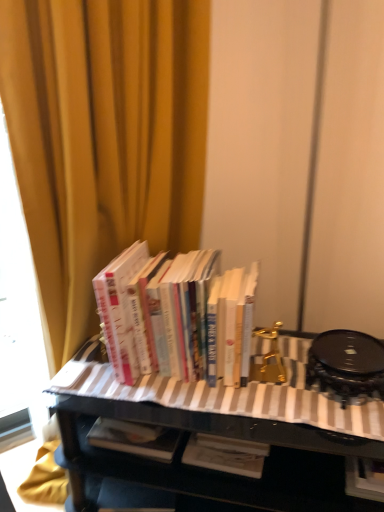
Question: Should I look upward or downward to see black glossy table at center?

Choices:
 (A) up
 (B) down

Answer: (B)

Question: From a real-world perspective, is hardcover books at center positioned under yellow fabric curtain at upper left based on gravity?

Choices:
 (A) no
 (B) yes

Answer: (B)

Question: Does hardcover books at center have a smaller size compared to yellow fabric curtain at upper left?

Choices:
 (A) yes
 (B) no

Answer: (A)

Question: Is hardcover books at center wider than yellow fabric curtain at upper left?

Choices:
 (A) yes
 (B) no

Answer: (B)

Question: Is hardcover books at center to the right of yellow fabric curtain at upper left from the viewer's perspective?

Choices:
 (A) yes
 (B) no

Answer: (A)

Question: Is hardcover books at center oriented away from yellow fabric curtain at upper left?

Choices:
 (A) yes
 (B) no

Answer: (A)

Question: Does hardcover books at center have a lesser width compared to yellow fabric curtain at upper left?

Choices:
 (A) yes
 (B) no

Answer: (A)

Question: Could you tell me if black glossy table at center is turned towards hardcover books at center?

Choices:
 (A) yes
 (B) no

Answer: (B)

Question: Is black glossy table at center closer to the viewer compared to hardcover books at center?

Choices:
 (A) yes
 (B) no

Answer: (A)

Question: Is black glossy table at center shorter than hardcover books at center?

Choices:
 (A) yes
 (B) no

Answer: (B)

Question: Can you confirm if black glossy table at center is thinner than hardcover books at center?

Choices:
 (A) yes
 (B) no

Answer: (B)

Question: Can you confirm if black glossy table at center is taller than hardcover books at center?

Choices:
 (A) no
 (B) yes

Answer: (B)

Question: Is black glossy table at center far away from hardcover books at center?

Choices:
 (A) yes
 (B) no

Answer: (B)

Question: Is black glossy table at center taller than yellow fabric curtain at upper left?

Choices:
 (A) no
 (B) yes

Answer: (A)